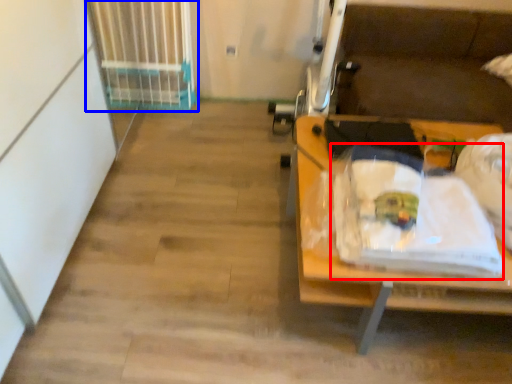
Question: Which point is closer to the camera, waste (highlighted by a red box) or radiator (highlighted by a blue box)?

Choices:
 (A) waste
 (B) radiator

Answer: (A)